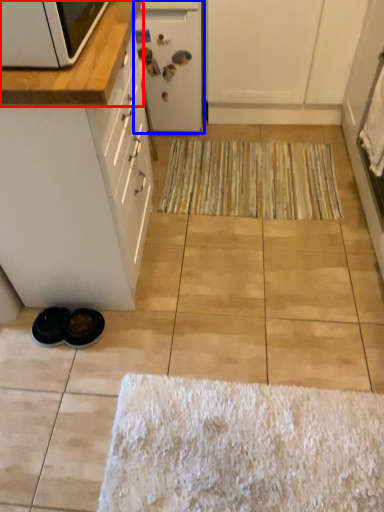
Question: Which object appears farthest to the camera in this image, countertop (highlighted by a red box) or appliance (highlighted by a blue box)?

Choices:
 (A) countertop
 (B) appliance

Answer: (B)